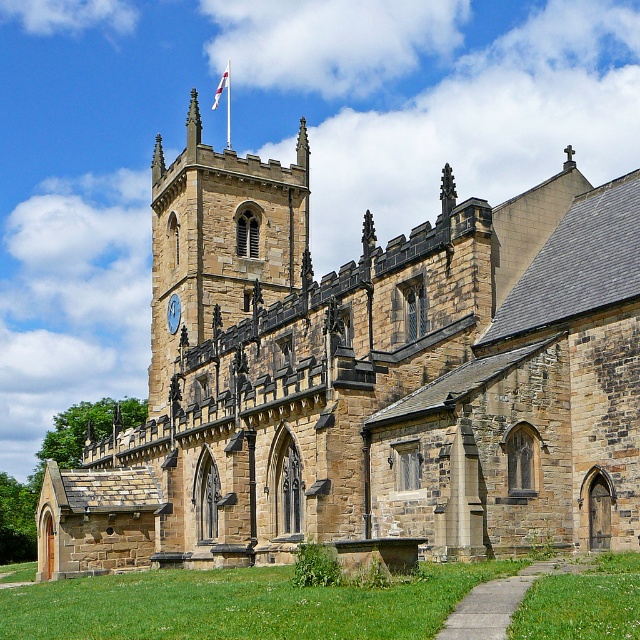
Question: Does stone clock tower at upper center appear under blue stone clock at center?

Choices:
 (A) yes
 (B) no

Answer: (B)

Question: Which of these objects is positioned closest to the stone clock tower at upper center?

Choices:
 (A) white fabric flag at upper center
 (B) brown stone church at center

Answer: (B)

Question: Which point is closer to the camera taking this photo?

Choices:
 (A) 177,298
 (B) 292,285
 (C) 224,86
 (D) 273,493

Answer: (D)

Question: From the image, what is the correct spatial relationship of brown stone church at center in relation to white fabric flag at upper center?

Choices:
 (A) left
 (B) right

Answer: (B)

Question: Which of the following is the farthest from the observer?

Choices:
 (A) (216, 97)
 (B) (172, 312)
 (C) (161, 262)
 (D) (294, 204)

Answer: (A)

Question: Does brown stone church at center appear on the right side of blue stone clock at center?

Choices:
 (A) yes
 (B) no

Answer: (A)